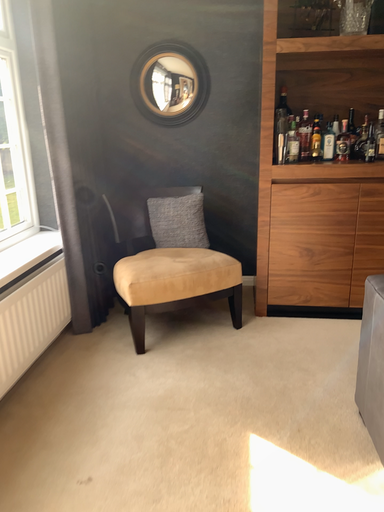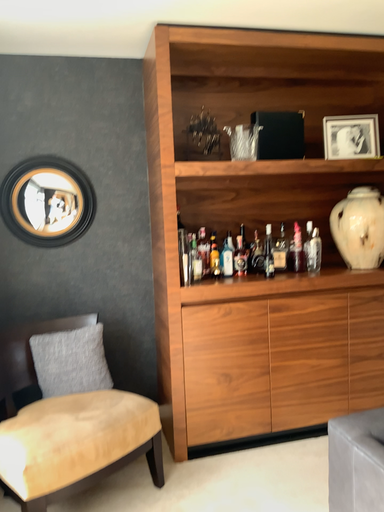
Question: Which way did the camera rotate in the video?

Choices:
 (A) rotated right
 (B) rotated left

Answer: (A)